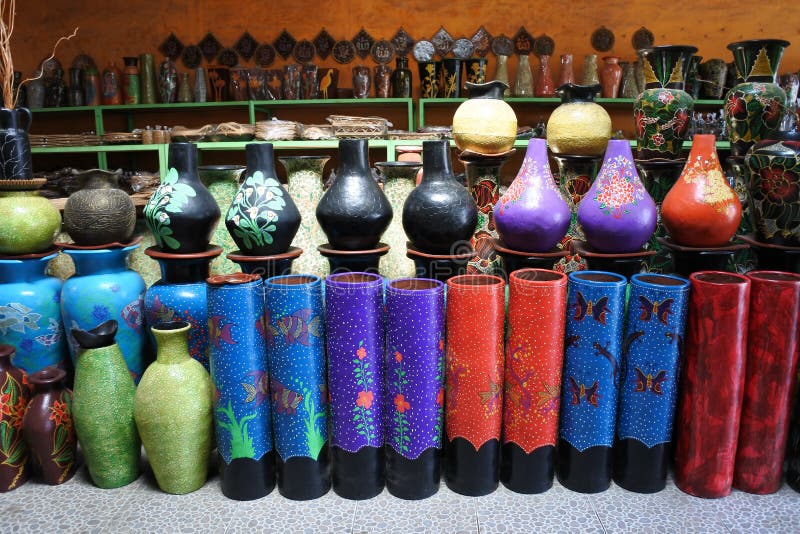
Where is `wall`? wall is located at coordinates click(x=473, y=19).